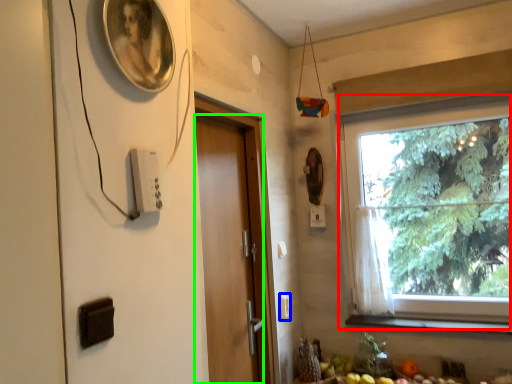
Question: Based on their relative distances, which object is farther from window (highlighted by a red box)? Choose from light switch (highlighted by a blue box) and door (highlighted by a green box).

Choices:
 (A) light switch
 (B) door

Answer: (A)